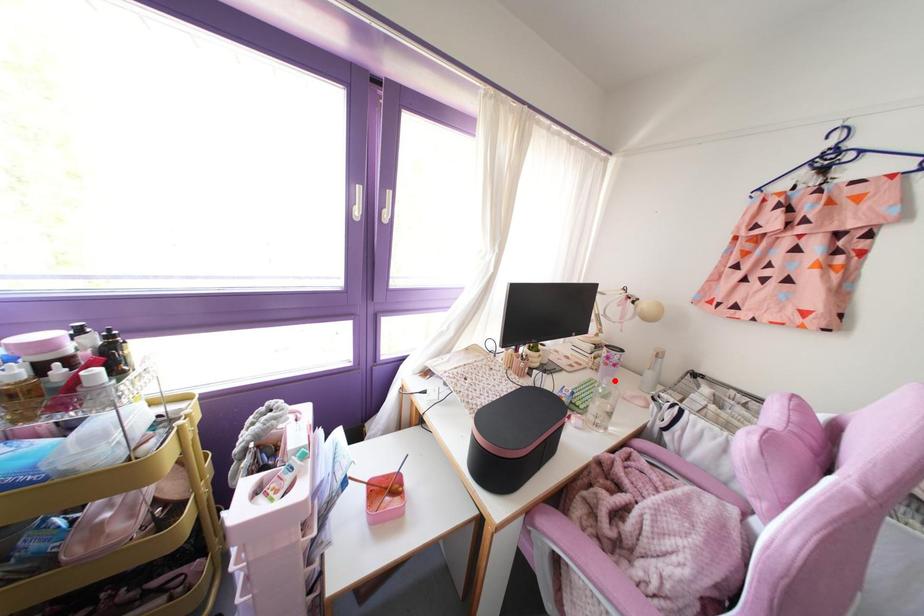
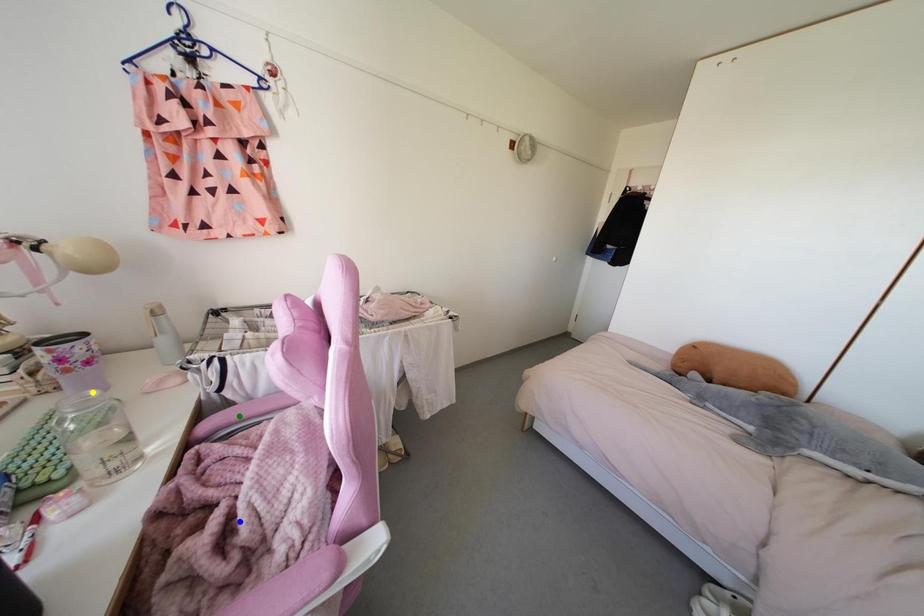
Question: I am providing you with two images of the same scene from different viewpoints. A red point is marked on the first image. You are given multiple points on the second image. Which point in image 2 is actually the same real-world point as the red point in image 1?

Choices:
 (A) green point
 (B) blue point
 (C) yellow point

Answer: (C)